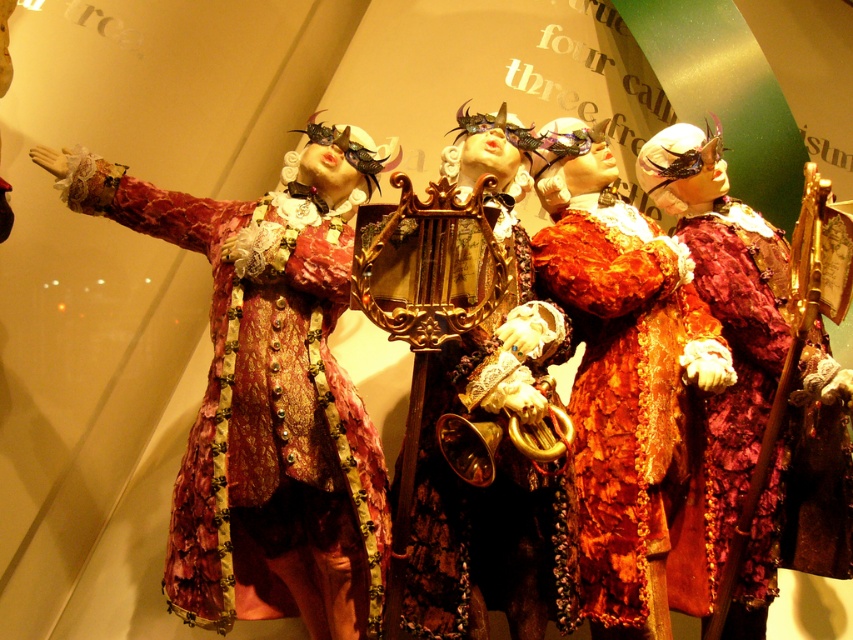
Consider the image. Who is higher up, gold metallic lyre at center or floral velvet robe at center?

Positioned higher is gold metallic lyre at center.

Does point (518, 531) come farther from viewer compared to point (817, 445)?

That is False.

Where is `gold metallic lyre at center`? This screenshot has width=853, height=640. gold metallic lyre at center is located at coordinates (491, 484).

Does velvet maroon dress at center have a smaller size compared to gold metallic lyre at center?

Yes.

How distant is velvet maroon dress at center from gold metallic lyre at center?

A distance of 14.74 inches exists between velvet maroon dress at center and gold metallic lyre at center.

Between point (648, 516) and point (460, 500), which one is positioned in front?

Point (460, 500) is more forward.

Locate an element on the screen. velvet maroon dress at center is located at coordinates (631, 408).

Between point (262, 314) and point (781, 442), which one is positioned behind?

The point (781, 442) is more distant.

Can you confirm if velvet brocade coat at center is positioned above floral velvet robe at center?

Yes.

Which is in front, point (338, 524) or point (751, 316)?

Point (338, 524)

I want to click on velvet brocade coat at center, so click(267, 404).